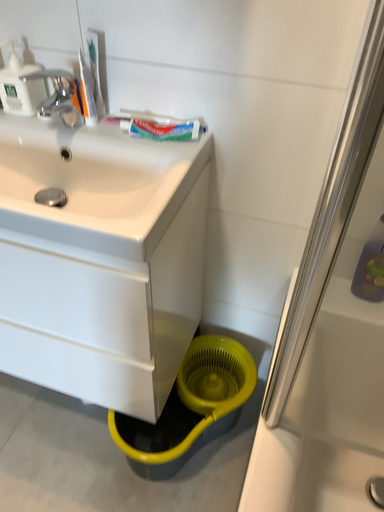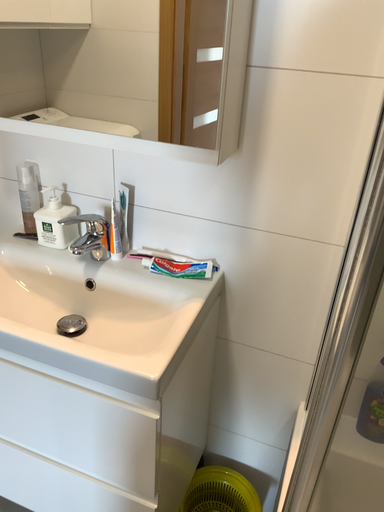
Question: Which way did the camera rotate in the video?

Choices:
 (A) rotated upward
 (B) rotated downward

Answer: (A)